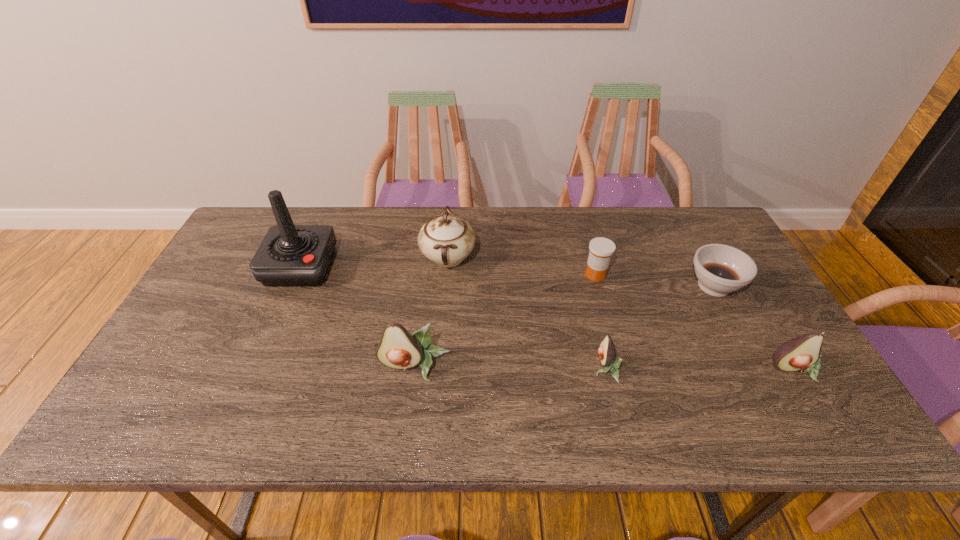
Find the location of `free spot between the chinaware and the soup bowl`. free spot between the chinaware and the soup bowl is located at coordinates (581, 272).

Locate an element on the screen. vacant area between the soup bowl and the leftmost avocado is located at coordinates (564, 326).

This screenshot has height=540, width=960. In order to click on free space between the soup bowl and the second avocado from right to left in this screenshot , I will do `click(660, 327)`.

Find the location of a particular element. The width and height of the screenshot is (960, 540). vacant point located between the leftmost avocado and the soup bowl is located at coordinates (564, 326).

This screenshot has width=960, height=540. Identify the location of vacant area between the chinaware and the soup bowl. (581, 272).

Find the location of a particular element. the fourth closest object to the second shortest avocado is located at coordinates (447, 239).

Select which object appears as the sixth closest to the leftmost avocado. Please provide its 2D coordinates. Your answer should be formatted as a tuple, i.e. [(x, y)], where the tuple contains the x and y coordinates of a point satisfying the conditions above.

[(801, 353)]

Select which avocado appears as the second closest to the leftmost object. Please provide its 2D coordinates. Your answer should be formatted as a tuple, i.e. [(x, y)], where the tuple contains the x and y coordinates of a point satisfying the conditions above.

[(607, 353)]

Identify which avocado is the second nearest to the leftmost avocado. Please provide its 2D coordinates. Your answer should be formatted as a tuple, i.e. [(x, y)], where the tuple contains the x and y coordinates of a point satisfying the conditions above.

[(801, 353)]

Identify the location of vacant space that satisfies the following two spatial constraints: 1. on the label of the medicine; 2. on the seed side of the second avocado from right to left. This screenshot has height=540, width=960. (621, 368).